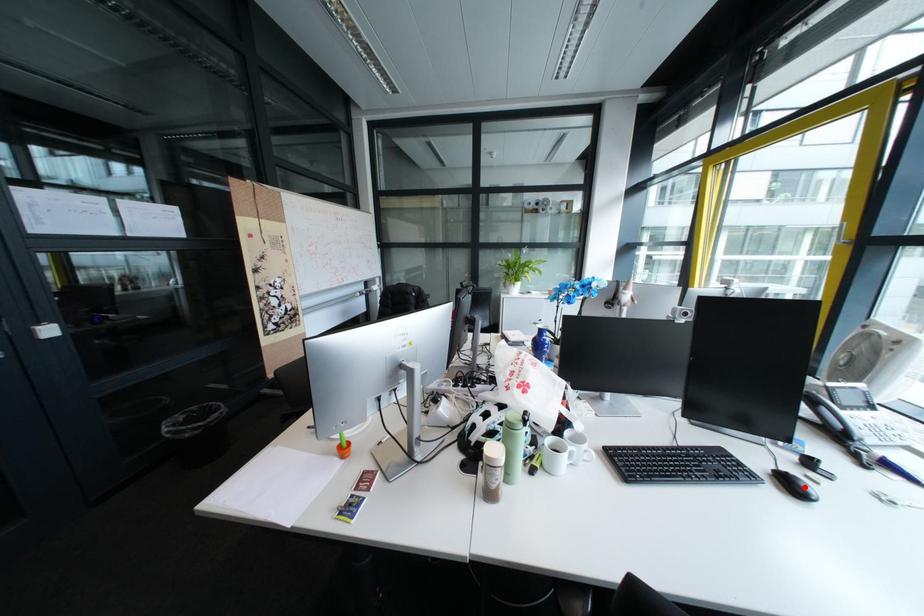
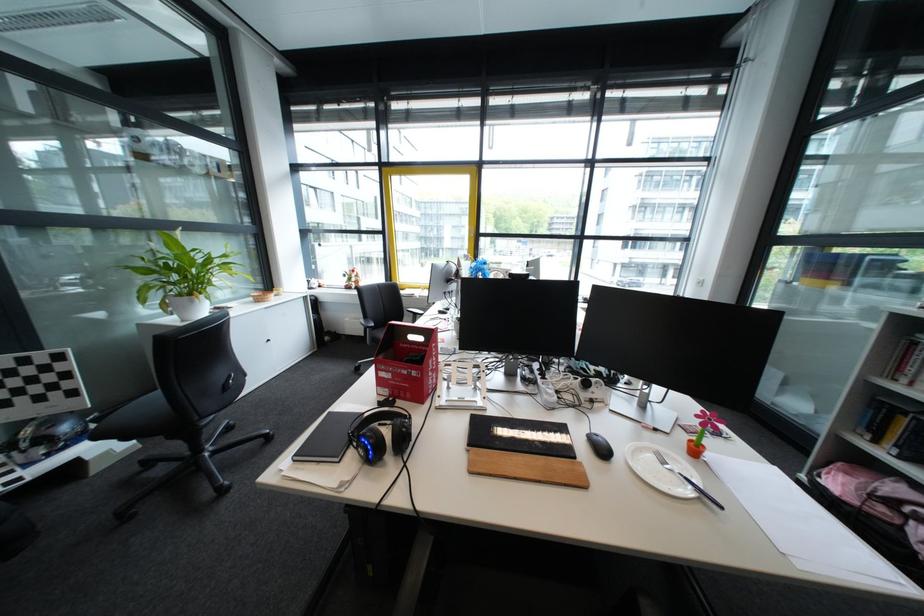
Question: I am providing you with two images of the same scene from different viewpoints. A red point is marked on the first image. Is the red point's position out of view in image 2?

Choices:
 (A) Yes
 (B) No

Answer: (A)